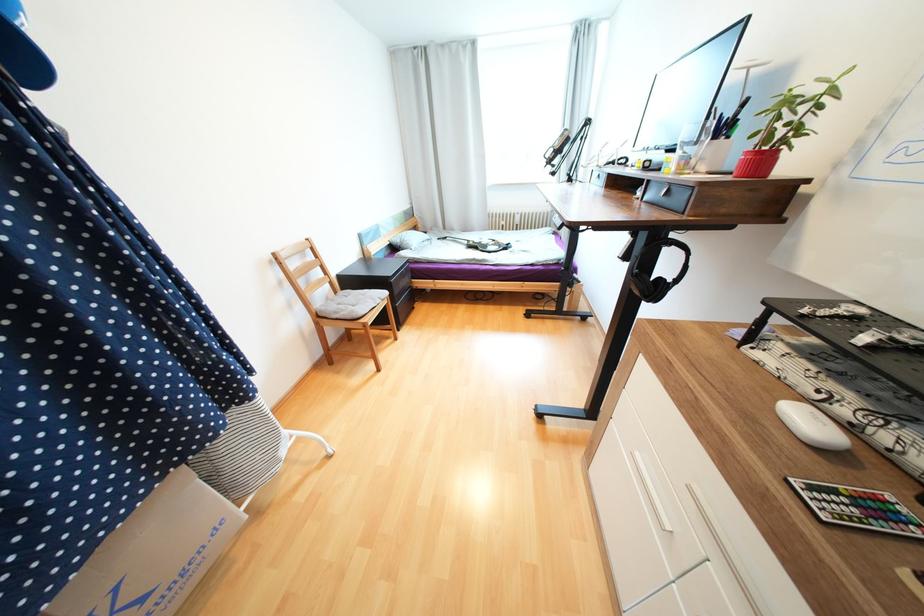
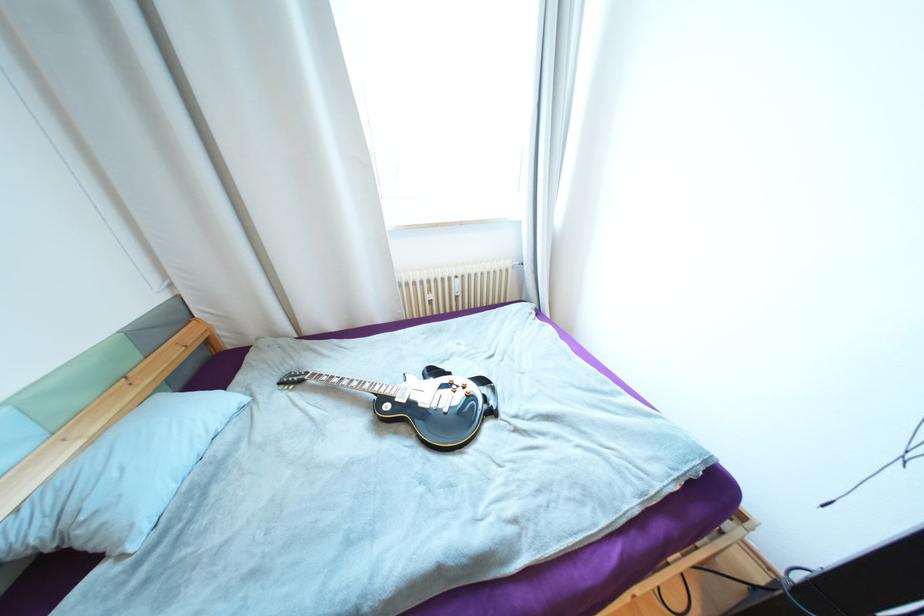
The point at (523,225) is marked in the first image. Where is the corresponding point in the second image?

(463, 297)